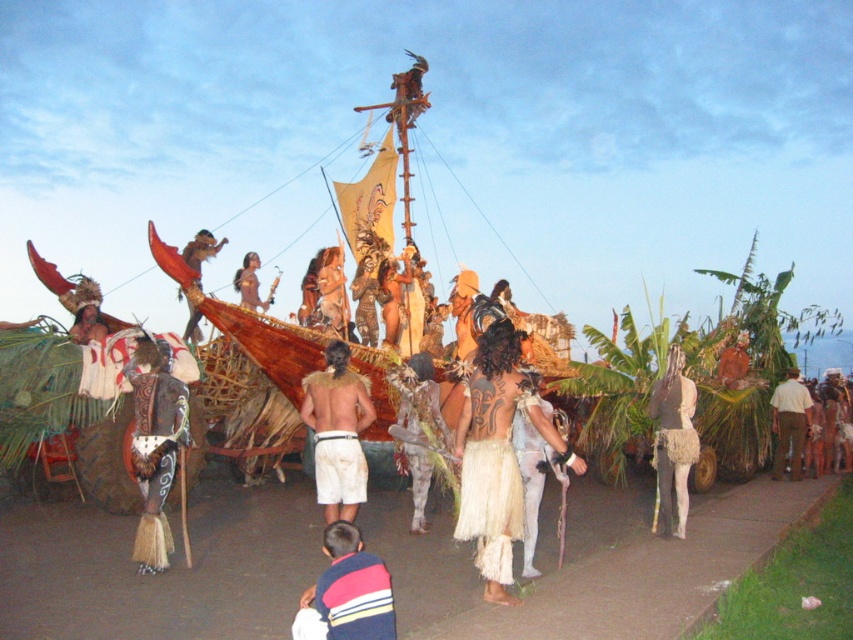
Can you confirm if striped sweater at lower center is shorter than brown textured pants at lower right?

Indeed, striped sweater at lower center has a lesser height compared to brown textured pants at lower right.

Which is more to the left, striped sweater at lower center or brown textured pants at lower right?

striped sweater at lower center

Between point (363, 605) and point (779, 449), which one is positioned in front?

Point (363, 605) is in front.

Locate an element on the screen. This screenshot has width=853, height=640. striped sweater at lower center is located at coordinates (346, 593).

Image resolution: width=853 pixels, height=640 pixels. What do you see at coordinates (672, 442) in the screenshot? I see `white fringed skirt at center` at bounding box center [672, 442].

Which is in front, point (665, 528) or point (798, 422)?

Positioned in front is point (665, 528).

Is point (665, 371) positioned before point (790, 460)?

Yes, point (665, 371) is closer to viewer.

This screenshot has width=853, height=640. Find the location of `white fringed skirt at center`. white fringed skirt at center is located at coordinates (672, 442).

Can you confirm if white woven shorts at center is positioned above brown textured pants at lower right?

Yes.

Does point (326, 465) come in front of point (782, 406)?

Yes, point (326, 465) is closer to viewer.

Locate an element on the screen. This screenshot has height=640, width=853. white woven shorts at center is located at coordinates (337, 433).